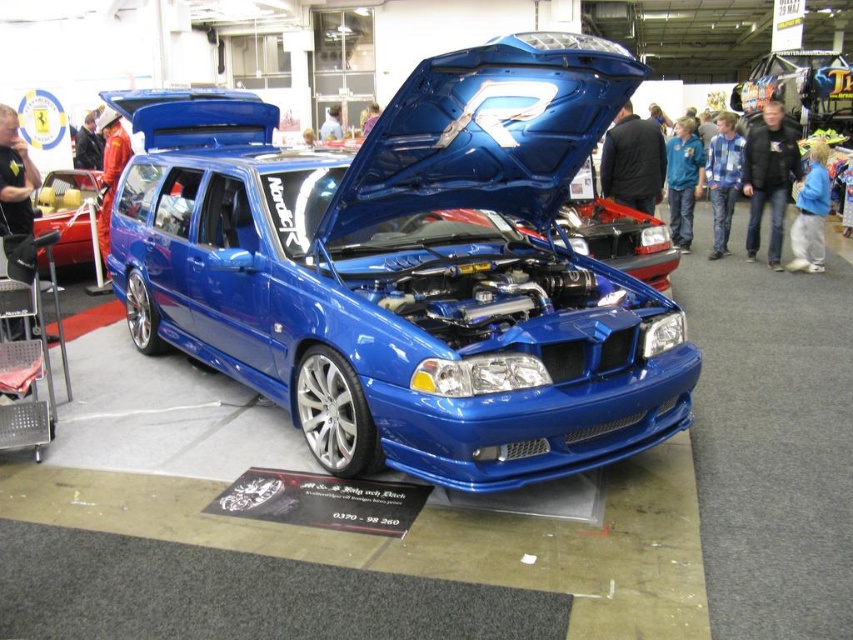
Is shiny blue car at center taller than metallic yellow car at left?

Yes.

Can you confirm if shiny blue car at center is positioned to the right of metallic yellow car at left?

Correct, you'll find shiny blue car at center to the right of metallic yellow car at left.

Between point (463, 58) and point (50, 196), which one is positioned in front?

Point (463, 58)

Locate an element on the screen. shiny blue car at center is located at coordinates point(410,272).